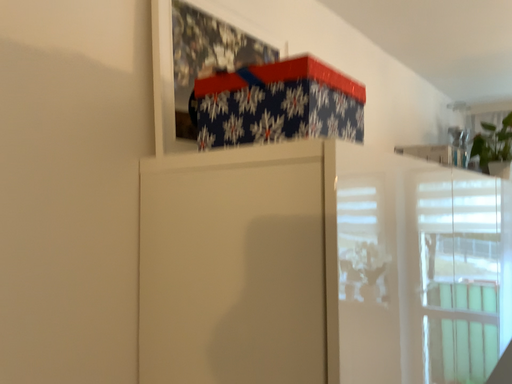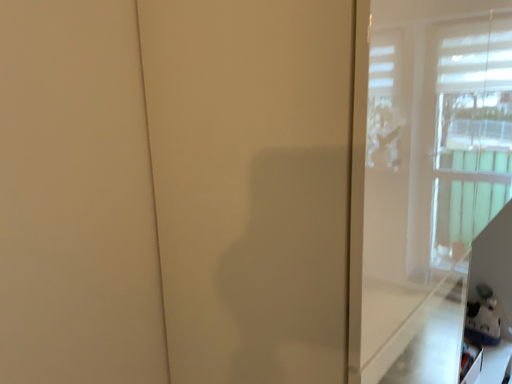
Question: How did the camera likely rotate when shooting the video?

Choices:
 (A) rotated downward
 (B) rotated upward

Answer: (A)